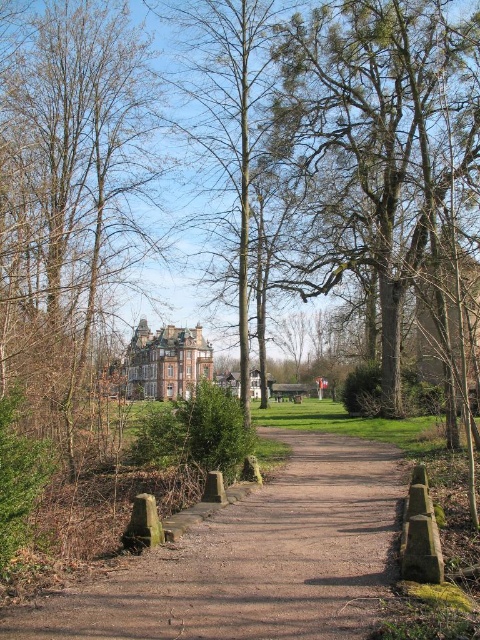
Question: Which of the following is the closest to the observer?

Choices:
 (A) (344, 1)
 (B) (85, 598)

Answer: (B)

Question: Which point is farther from the camera taking this photo?

Choices:
 (A) (148, 140)
 (B) (367, 516)
 (C) (334, 74)

Answer: (C)

Question: Is brown leafless tree at left to the left of dirt/gravel path at center from the viewer's perspective?

Choices:
 (A) no
 (B) yes

Answer: (B)

Question: In this image, where is dirt/gravel path at center located relative to green leafy tree at center?

Choices:
 (A) below
 (B) above

Answer: (A)

Question: Which object appears farthest from the camera in this image?

Choices:
 (A) brown leafless tree at left
 (B) dirt/gravel path at center

Answer: (A)

Question: Is brown leafless tree at left further to camera compared to dirt/gravel path at center?

Choices:
 (A) no
 (B) yes

Answer: (B)